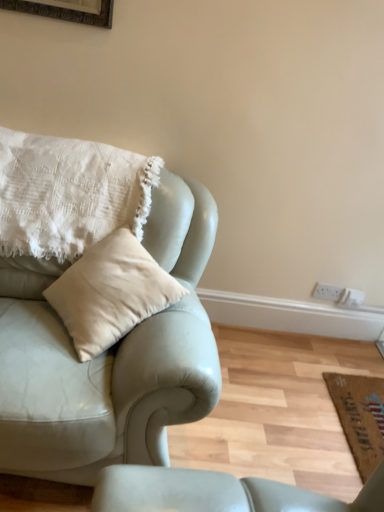
Question: Would you say brown woven mat at lower right is part of matte leather couch at left's contents?

Choices:
 (A) no
 (B) yes

Answer: (A)

Question: From the image's perspective, does matte leather couch at left appear lower than brown woven mat at lower right?

Choices:
 (A) no
 (B) yes

Answer: (A)

Question: Would you say matte leather couch at left is a long distance from brown woven mat at lower right?

Choices:
 (A) yes
 (B) no

Answer: (A)

Question: Considering the relative sizes of matte leather couch at left and brown woven mat at lower right in the image provided, is matte leather couch at left bigger than brown woven mat at lower right?

Choices:
 (A) no
 (B) yes

Answer: (B)

Question: Can you confirm if matte leather couch at left is positioned to the left of brown woven mat at lower right?

Choices:
 (A) yes
 (B) no

Answer: (A)

Question: Does matte leather couch at left appear on the right side of brown woven mat at lower right?

Choices:
 (A) yes
 (B) no

Answer: (B)

Question: Is white textured pillow at upper left oriented towards matte leather couch at left?

Choices:
 (A) yes
 (B) no

Answer: (A)

Question: Considering the relative sizes of white textured pillow at upper left and matte leather couch at left in the image provided, is white textured pillow at upper left bigger than matte leather couch at left?

Choices:
 (A) yes
 (B) no

Answer: (B)

Question: From the image's perspective, does white textured pillow at upper left appear lower than matte leather couch at left?

Choices:
 (A) no
 (B) yes

Answer: (A)

Question: Is white textured pillow at upper left positioned beyond the bounds of matte leather couch at left?

Choices:
 (A) yes
 (B) no

Answer: (B)

Question: Are white textured pillow at upper left and matte leather couch at left beside each other?

Choices:
 (A) yes
 (B) no

Answer: (B)

Question: Would you say white textured pillow at upper left contains matte leather couch at left?

Choices:
 (A) no
 (B) yes

Answer: (A)

Question: Can you confirm if brown woven mat at lower right is thinner than white textured pillow at upper left?

Choices:
 (A) yes
 (B) no

Answer: (A)